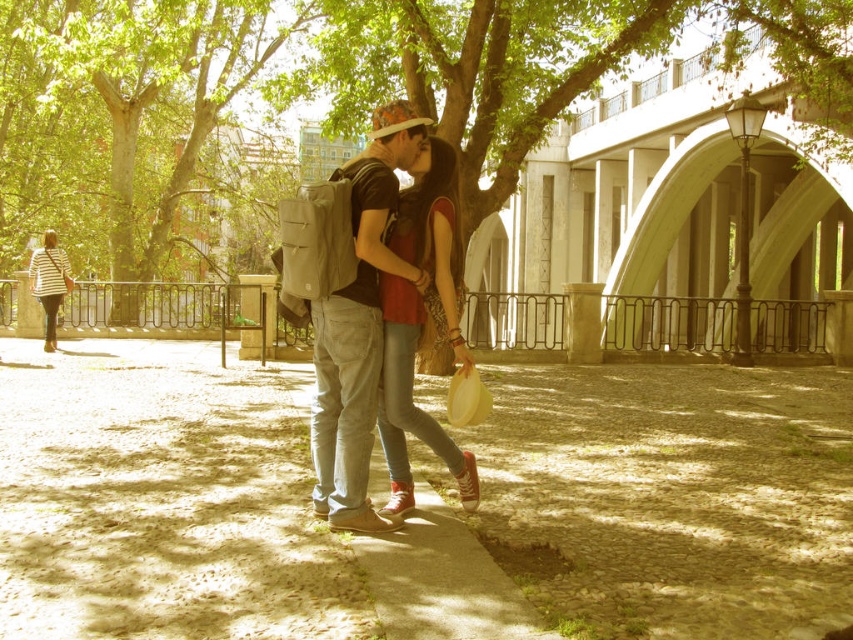
You are standing at the viewpoint of the image and want to know how far the point at coordinates [181,38] is from you. Can you determine the distance?

The point at coordinates [181,38] is 15.92 meters away from the viewer.

You are a park visitor who wants to walk on the brown gravel pavement at center. However, you are wearing the matte red sneakers at center. Is there a risk that your sneakers will get stuck in the pavement?

The brown gravel pavement at center is bigger than matte red sneakers at center, so the sneakers are smaller than the pavement. Therefore, there is no risk of the sneakers getting stuck in the pavement.

Looking at this image, you are standing at the center of the image and want to walk towards the green leafy tree at center. Which direction should you move?

The green leafy tree at center is already at the center of the image, so you are already facing it. You don not need to move in any direction to reach it.